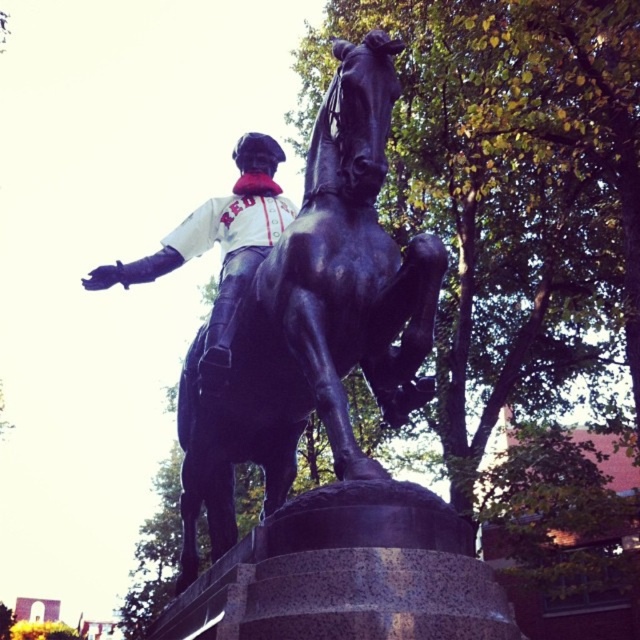
You are standing at the base of the statue of the man on the horse. You notice two points marked on the statue. The first point is at coordinate point [276,372] and the second is at point [200,381]. If you were to walk around the statue to get a better view, which point would you need to move closer to in order to see both points clearly at the same time?

To see both points clearly at the same time, you should move closer to point [200,381] because point [276,372] is behind it, so positioning yourself near the front point allows both to be in view.

You are a photographer trying to capture the statue of the rider and horse. You want to ensure both the black polished horse at center and the white matte jersey at center are clearly visible in your photo. Given their sizes, which object should you focus on first to ensure it stands out more in the composition?

The black polished horse at center is much taller than the white matte jersey at center, so focusing on the horse first will ensure it stands out more in the composition.